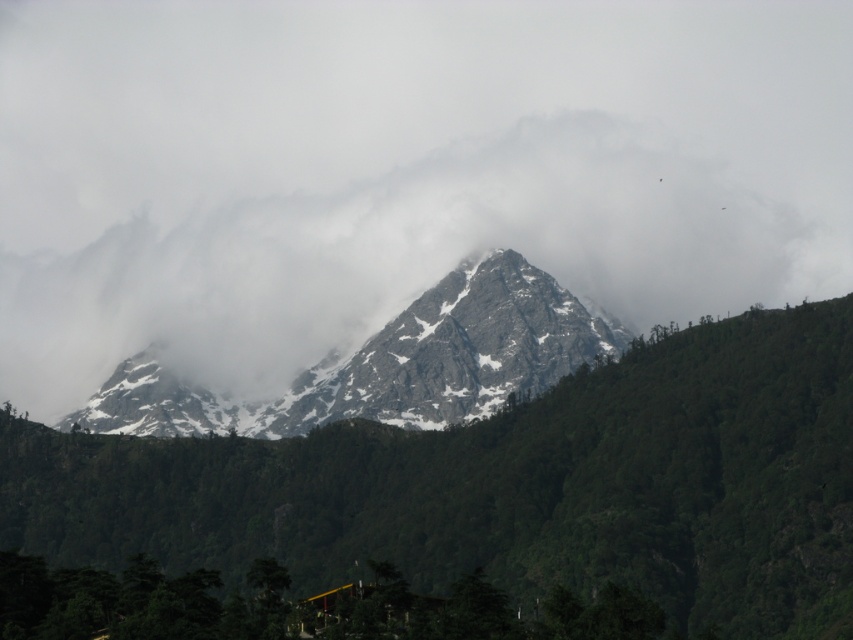
Based on the scene description, which object has a greater width between the snowy rocky mountain at center and the snowy granite peak at center?

The snowy rocky mountain at center has a greater width than the snowy granite peak at center.

You are a hiker planning to take a photo of the white fluffy cloud at center from the base of the snowy rocky mountain at center. Will the mountain block your view of the cloud?

The white fluffy cloud at center is behind the snowy rocky mountain at center, so the mountain will block your view of the cloud.